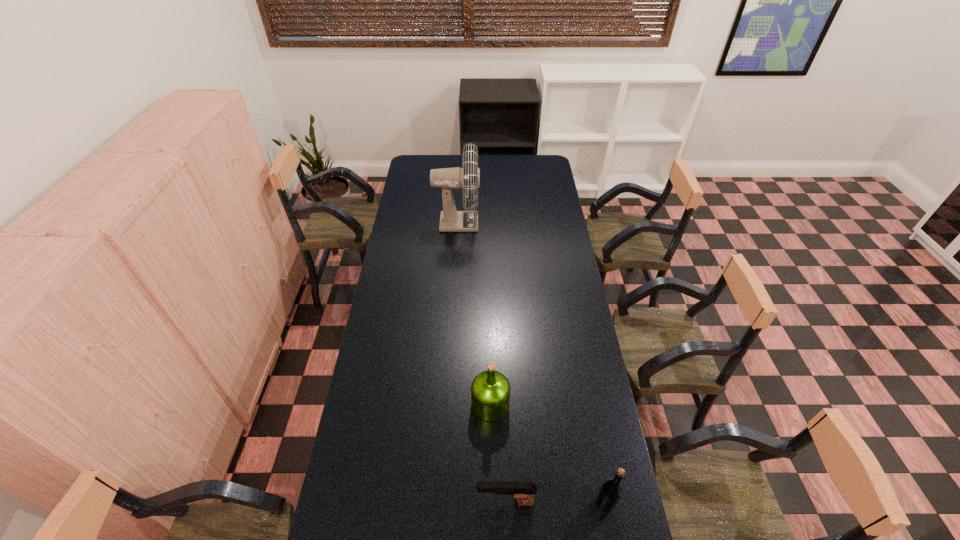
Find the location of a particular element. the tallest object is located at coordinates (446, 178).

This screenshot has height=540, width=960. In order to click on the farthest object in this screenshot , I will do `click(446, 178)`.

Image resolution: width=960 pixels, height=540 pixels. In order to click on olive oil in this screenshot , I will do pos(490,391).

Locate an element on the screen. the rightmost object is located at coordinates (610, 492).

Image resolution: width=960 pixels, height=540 pixels. I want to click on pistol, so click(523, 492).

This screenshot has width=960, height=540. In order to click on vacant space positioned 0.240m on the air flow direction of the farthest object in this screenshot , I will do `click(526, 222)`.

Where is `vacant space located on the left of the second farthest object`? This screenshot has width=960, height=540. vacant space located on the left of the second farthest object is located at coordinates (454, 404).

Where is `vacant space located on the left of the beer bottle`? vacant space located on the left of the beer bottle is located at coordinates (490, 503).

The height and width of the screenshot is (540, 960). What are the coordinates of `vacant area located at the barrel of the pistol` in the screenshot? It's located at (397, 502).

Identify the location of free region located at the barrel of the pistol. (424, 502).